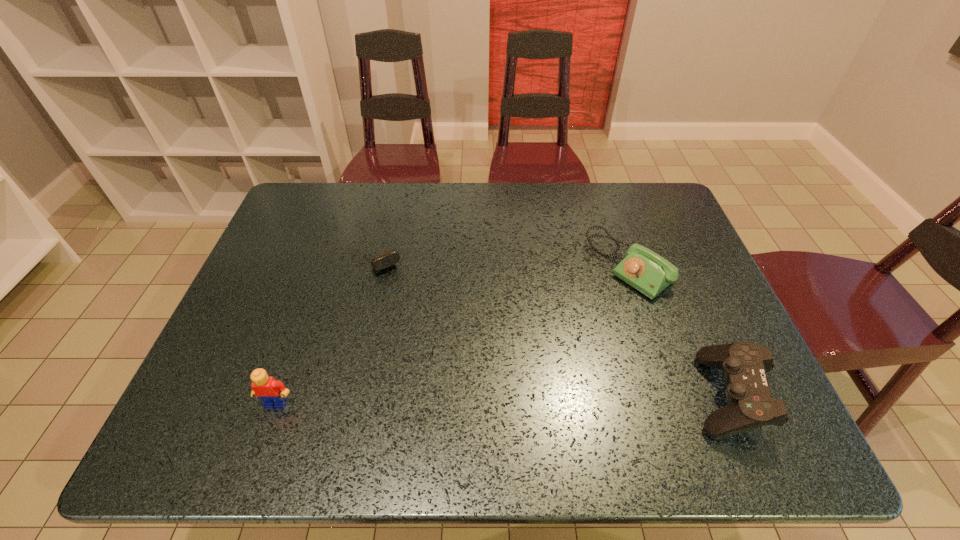
What are the coordinates of `Lego` in the screenshot? It's located at (273, 393).

Locate an element on the screen. The height and width of the screenshot is (540, 960). the tallest object is located at coordinates (273, 393).

You are a GUI agent. You are given a task and a screenshot of the screen. Output one action in this format:
    pyautogui.click(x=<x>, y=<y>)
    Task: Click on the control
    Image resolution: width=960 pixels, height=540 pixels.
    Given the screenshot: What is the action you would take?
    pyautogui.click(x=744, y=364)

Where is `webcam`? The height and width of the screenshot is (540, 960). webcam is located at coordinates (387, 259).

At what (x,y) coordinates should I click in order to perform the action: click on the shortest object. Please return your answer as a coordinate pair (x, y). The height and width of the screenshot is (540, 960). Looking at the image, I should click on (387, 259).

Identify the location of the second shortest object. This screenshot has height=540, width=960. (643, 269).

At what (x,y) coordinates should I click in order to perform the action: click on free space located 0.090m on the left of the control. Please return your answer as a coordinate pair (x, y). Looking at the image, I should click on (647, 394).

Find the location of `free location located on the front-facing side of the shortest object`. free location located on the front-facing side of the shortest object is located at coordinates (397, 288).

This screenshot has height=540, width=960. I want to click on vacant space situated 0.370m on the front-facing side of the shortest object, so click(x=456, y=370).

Identify the location of vacant region located 0.180m on the front-facing side of the shortest object. (417, 315).